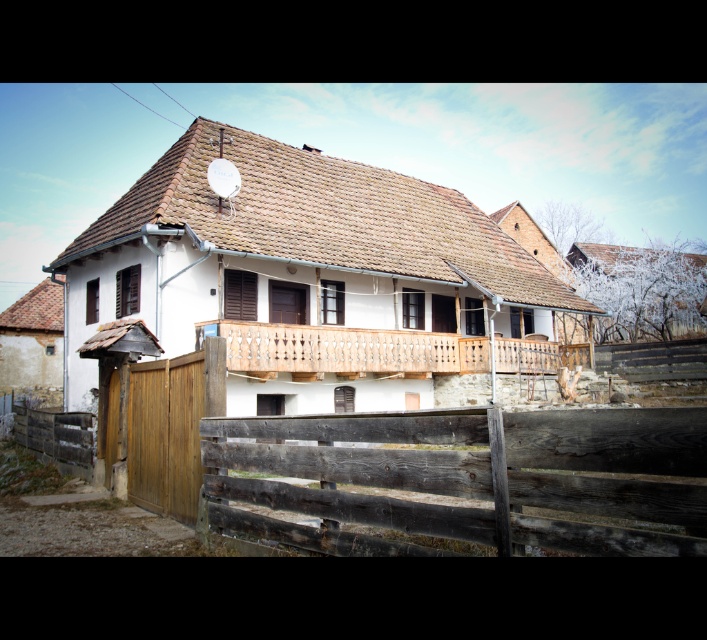
Question: Is weathered wood fence at lower center to the right of wooden at center from the viewer's perspective?

Choices:
 (A) no
 (B) yes

Answer: (A)

Question: Is weathered wood fence at lower center above wooden at center?

Choices:
 (A) no
 (B) yes

Answer: (A)

Question: Can you confirm if weathered wood fence at lower center is positioned to the left of wooden at center?

Choices:
 (A) no
 (B) yes

Answer: (B)

Question: Which of the following is the closest to the observer?

Choices:
 (A) (638, 540)
 (B) (391, 342)

Answer: (A)

Question: Which point is closer to the camera?

Choices:
 (A) weathered wood fence at lower center
 (B) wooden at center

Answer: (A)